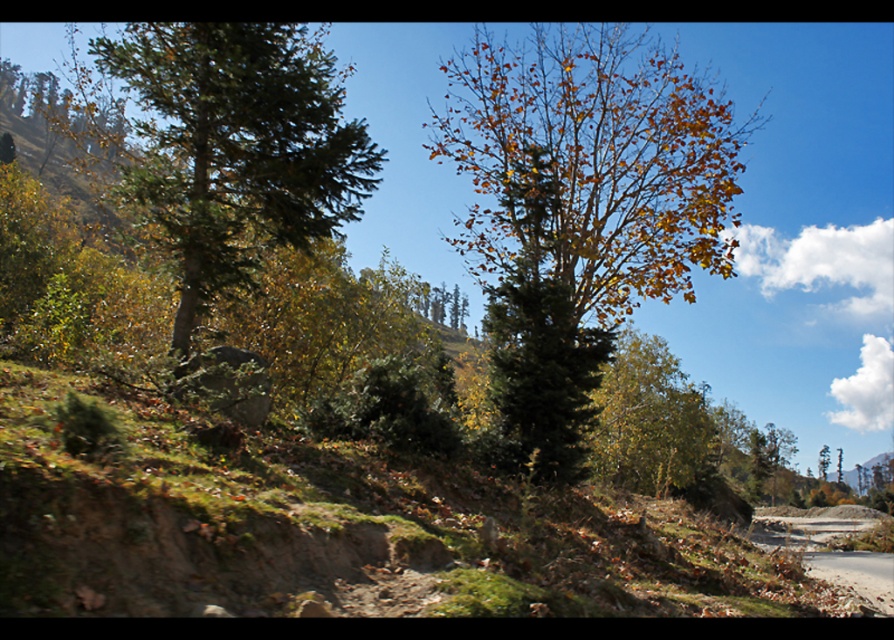
Question: Estimate the real-world distances between objects in this image. Which object is farther from the yellow-green foliage at center?

Choices:
 (A) green matte tree at left
 (B) dirt road at lower right

Answer: (B)

Question: Does green matte tree at left appear over dirt road at lower right?

Choices:
 (A) yes
 (B) no

Answer: (A)

Question: Is yellow-green foliage at center thinner than green matte tree at left?

Choices:
 (A) no
 (B) yes

Answer: (B)

Question: Which point appears closest to the camera in this image?

Choices:
 (A) 576,28
 (B) 294,209

Answer: (B)

Question: Which object is positioned farthest from the green matte tree at left?

Choices:
 (A) dirt road at lower right
 (B) yellow-green foliage at center

Answer: (A)

Question: Is yellow-green foliage at center to the left of green matte tree at left from the viewer's perspective?

Choices:
 (A) no
 (B) yes

Answer: (A)